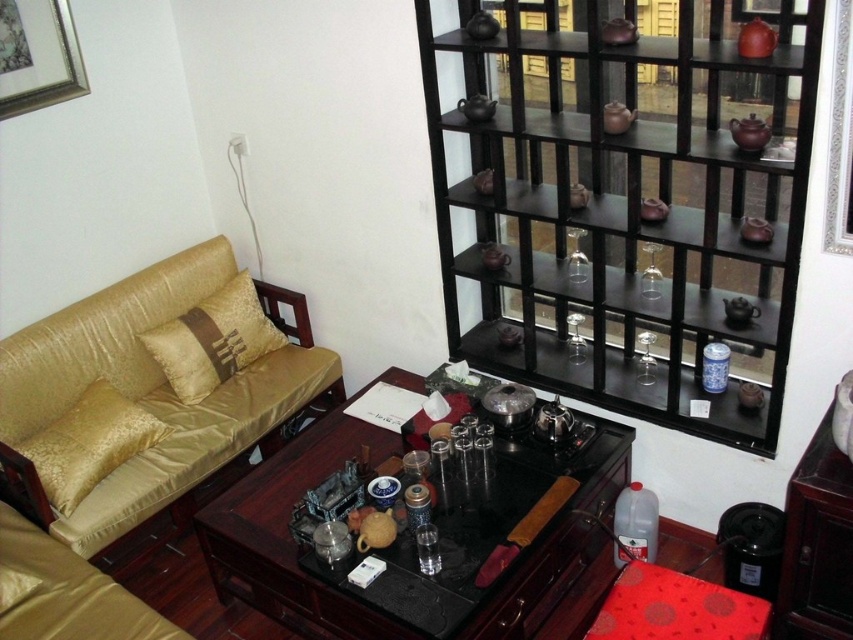
You are organizing items in the living room and need to place both the black wood shelf at upper right and the clear plastic bottle at lower right. Based on their sizes, which one should you place first if you want to start with the taller item?

The black wood shelf at upper right is taller than the clear plastic bottle at lower right, so you should place the black wood shelf at upper right first.

You are arranging a tea ceremony in the living room and need to place a new decorative item. The black wood shelf at upper right and the clear plastic bottle at lower right are both potential spots. Which location is closer to the observer?

The black wood shelf at upper right is closer to the observer because it is in front of the clear plastic bottle at lower right.